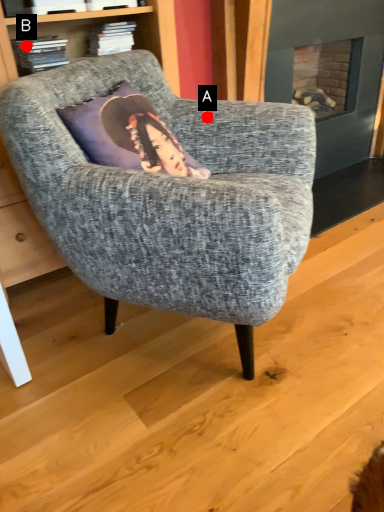
Question: Two points are circled on the image, labeled by A and B beside each circle. Which point appears farthest from the camera in this image?

Choices:
 (A) A is further
 (B) B is further

Answer: (A)